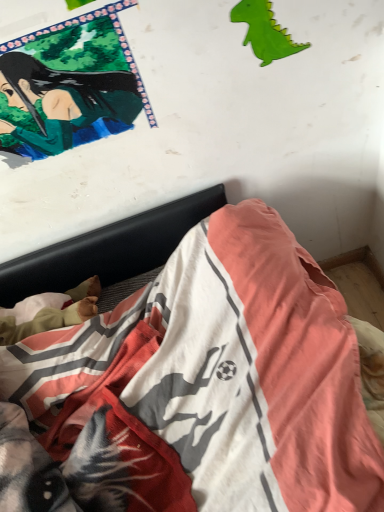
Question: From a real-world perspective, is green glossy poster at upper left physically located above or below green paper dinosaur at upper right?

Choices:
 (A) above
 (B) below

Answer: (A)

Question: Would you say green glossy poster at upper left is to the left or to the right of green paper dinosaur at upper right in the picture?

Choices:
 (A) left
 (B) right

Answer: (A)

Question: Based on their relative distances, which object is farther from the green glossy poster at upper left?

Choices:
 (A) cotton bedspread at lower center
 (B) green paper dinosaur at upper right

Answer: (A)

Question: Estimate the real-world distances between objects in this image. Which object is farther from the cotton bedspread at lower center?

Choices:
 (A) green paper dinosaur at upper right
 (B) green glossy poster at upper left

Answer: (A)